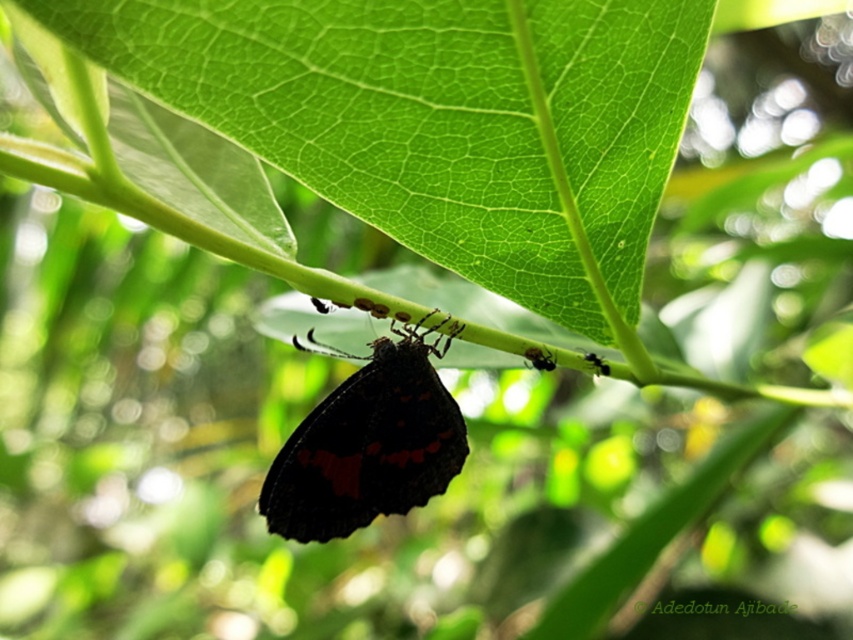
Question: Does green matte leaf at center lie behind shiny black ant at center?

Choices:
 (A) no
 (B) yes

Answer: (A)

Question: Does dark matte butterfly at center lie in front of shiny black ant at center?

Choices:
 (A) yes
 (B) no

Answer: (A)

Question: Which is farther from the dark matte butterfly at center?

Choices:
 (A) black matte ant at center
 (B) shiny black ant at center
 (C) green matte leaf at center

Answer: (A)

Question: Which object appears closest to the camera in this image?

Choices:
 (A) black matte ant at center
 (B) dark matte butterfly at center
 (C) shiny black ant at center
 (D) green matte leaf at center

Answer: (D)

Question: Which object is closer to the camera taking this photo?

Choices:
 (A) shiny black ant at center
 (B) green matte leaf at center
 (C) black matte ant at center

Answer: (B)

Question: Can you confirm if green matte leaf at center is positioned to the right of dark matte butterfly at center?

Choices:
 (A) no
 (B) yes

Answer: (B)